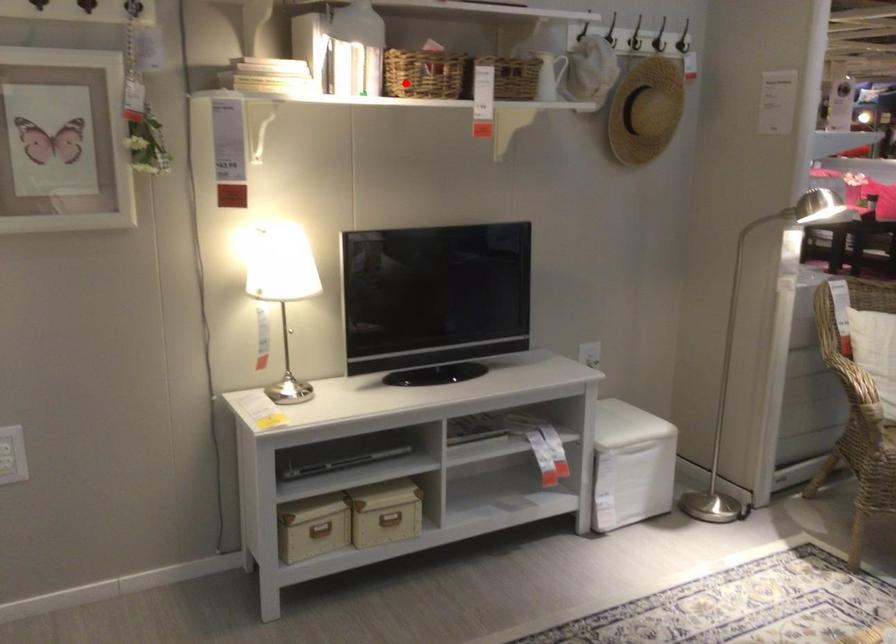
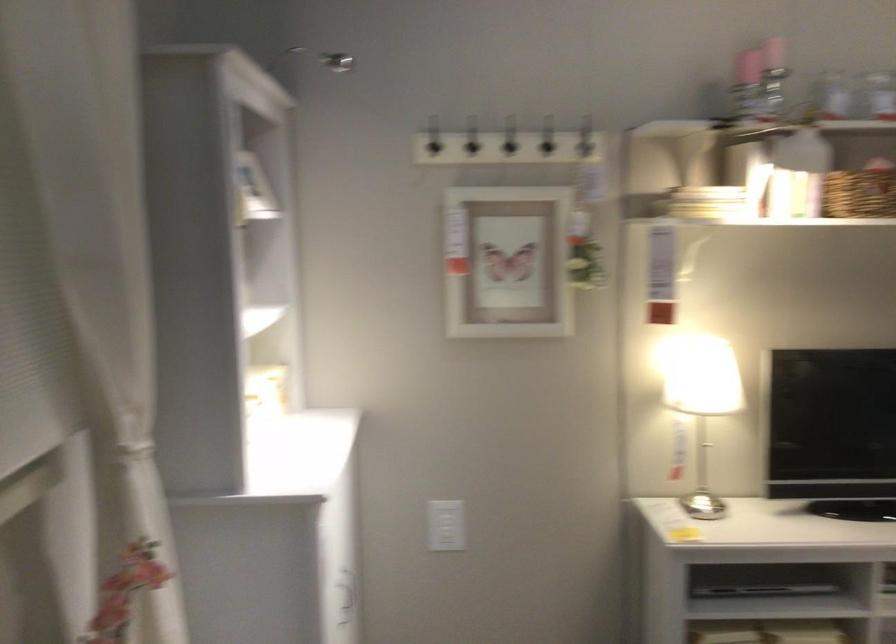
In the second image, find the point that corresponds to the highlighted location in the first image.

(859, 192)